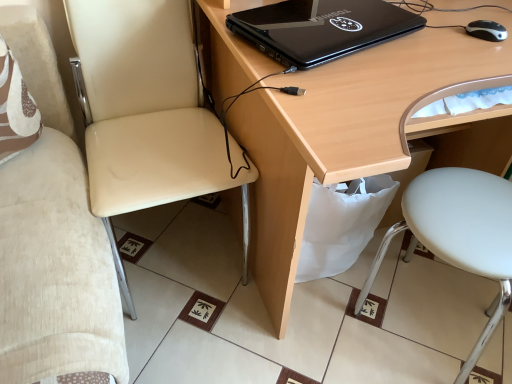
Locate an element on the screen. This screenshot has width=512, height=384. vacant space in front of beige leather chair at left, which is the 2th chair in right-to-left order is located at coordinates (199, 341).